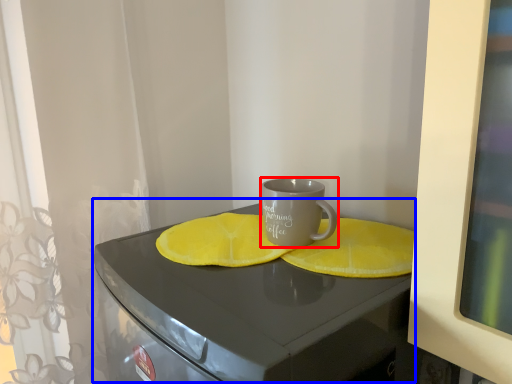
Question: Which of the following is the farthest to the observer, coffee cup (highlighted by a red box) or table (highlighted by a blue box)?

Choices:
 (A) coffee cup
 (B) table

Answer: (A)